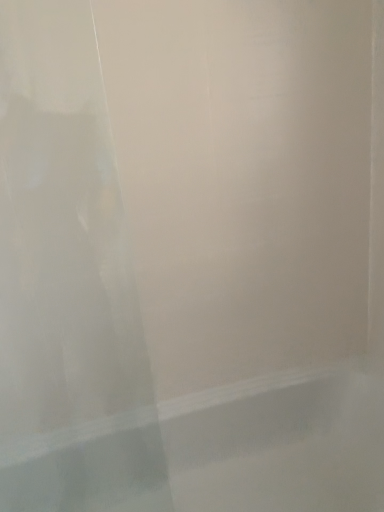
You are a GUI agent. You are given a task and a screenshot of the screen. Output one action in this format:
    pyautogui.click(x=<x>, y=<y>)
    Task: Click on the white glossy bathtub at lower right
    This screenshot has width=384, height=512.
    Given the screenshot: What is the action you would take?
    pyautogui.click(x=224, y=453)

Describe the element at coordinates (224, 453) in the screenshot. I see `white glossy bathtub at lower right` at that location.

I want to click on white glossy bathtub at lower right, so click(224, 453).